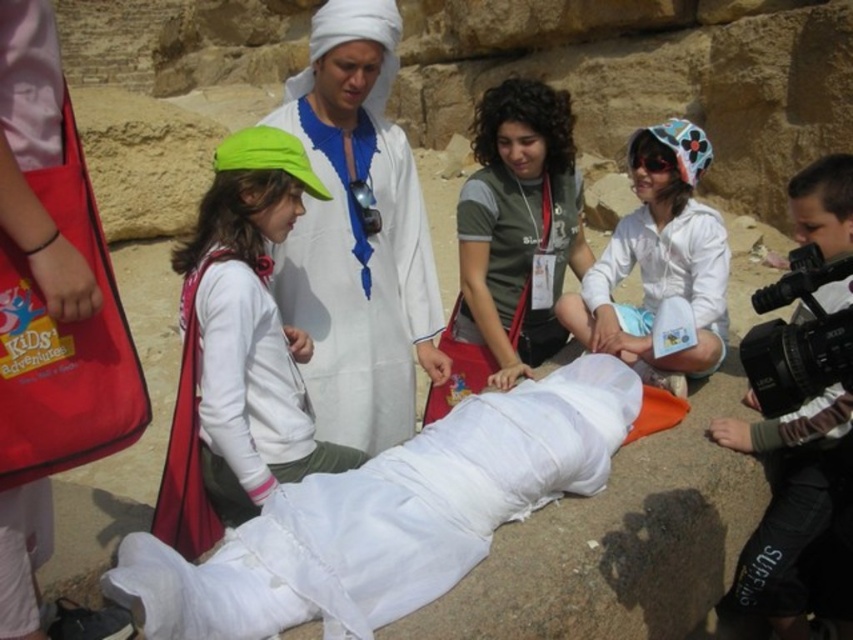
Question: Which of the following is the closest to the observer?

Choices:
 (A) (564, 234)
 (B) (248, 403)
 (C) (695, 353)

Answer: (B)

Question: Does white cotton cloth at center come in front of white matte/soft fabric at lower right?

Choices:
 (A) no
 (B) yes

Answer: (B)

Question: Does white cotton cloth at center have a smaller size compared to green fabric cap at upper left?

Choices:
 (A) no
 (B) yes

Answer: (B)

Question: Does white cotton robe at center have a lesser width compared to white matte hat at upper right?

Choices:
 (A) no
 (B) yes

Answer: (B)

Question: Which object is positioned farthest from the white matte hat at upper right?

Choices:
 (A) white matte/soft fabric at lower right
 (B) green fabric cap at upper left

Answer: (B)

Question: Which object is the farthest from the white cotton cloth at center?

Choices:
 (A) white matte/soft fabric at lower right
 (B) green fabric cap at upper left
 (C) white matte hat at upper right

Answer: (C)